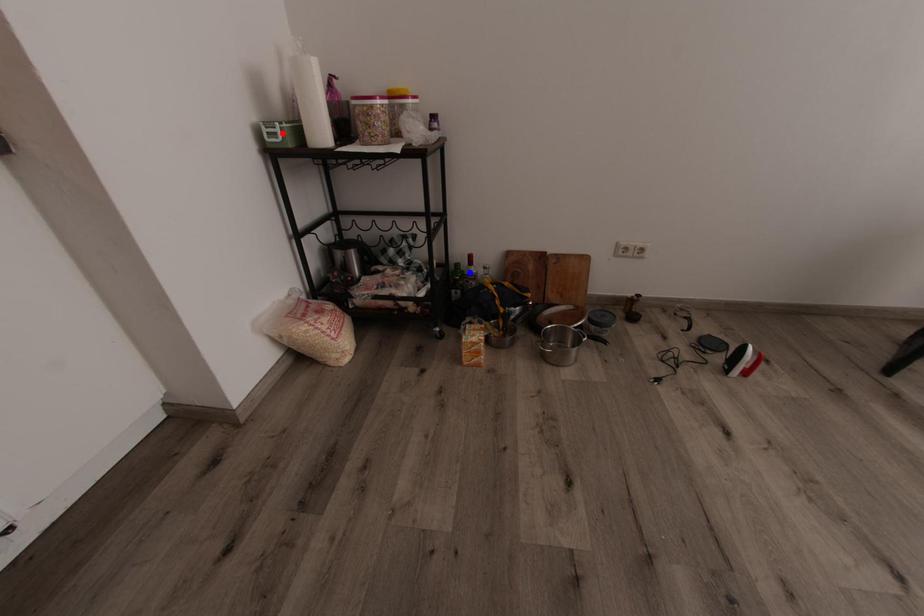
Question: Which of the two points in the image is closer to the camera?

Choices:
 (A) Blue point is closer.
 (B) Red point is closer.

Answer: (B)